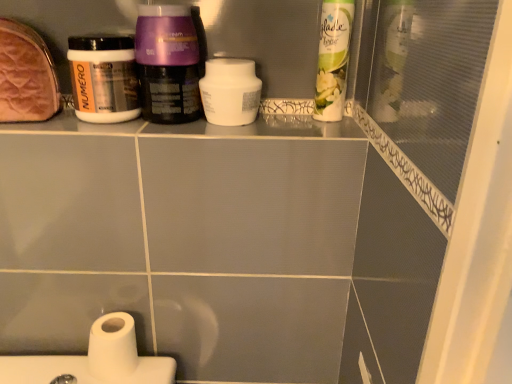
Question: From the image's perspective, relative to white glossy air freshener at upper right, the second cleaning product when ordered from left to right, is purple glossy cream at center, which is the 2th bottle in left-to-right order, above or below?

Choices:
 (A) below
 (B) above

Answer: (A)

Question: In the image, is purple glossy cream at center, the first bottle when ordered from right to left, on the left side or the right side of white glossy air freshener at upper right, the second cleaning product when ordered from left to right?

Choices:
 (A) right
 (B) left

Answer: (B)

Question: Estimate the real-world distances between objects in this image. Which object is farther from the white matte jar at upper left, which ranks as the 2th bottle in right-to-left order?

Choices:
 (A) purple glossy cream at center, which is the 2th bottle in left-to-right order
 (B) white matte toilet paper at lower left
 (C) leather-like brown pouch at upper left
 (D) white matte jar at center, which is counted as the 2th cleaning product, starting from the right
 (E) white glossy air freshener at upper right, the second cleaning product when ordered from left to right

Answer: (B)

Question: Estimate the real-world distances between objects in this image. Which object is closer to the white matte jar at upper left, the 1th bottle from the left?

Choices:
 (A) white matte jar at center, placed as the first cleaning product when sorted from left to right
 (B) white glossy air freshener at upper right, the second cleaning product when ordered from left to right
 (C) purple glossy cream at center, the first bottle when ordered from right to left
 (D) leather-like brown pouch at upper left
 (E) white matte toilet paper at lower left

Answer: (C)